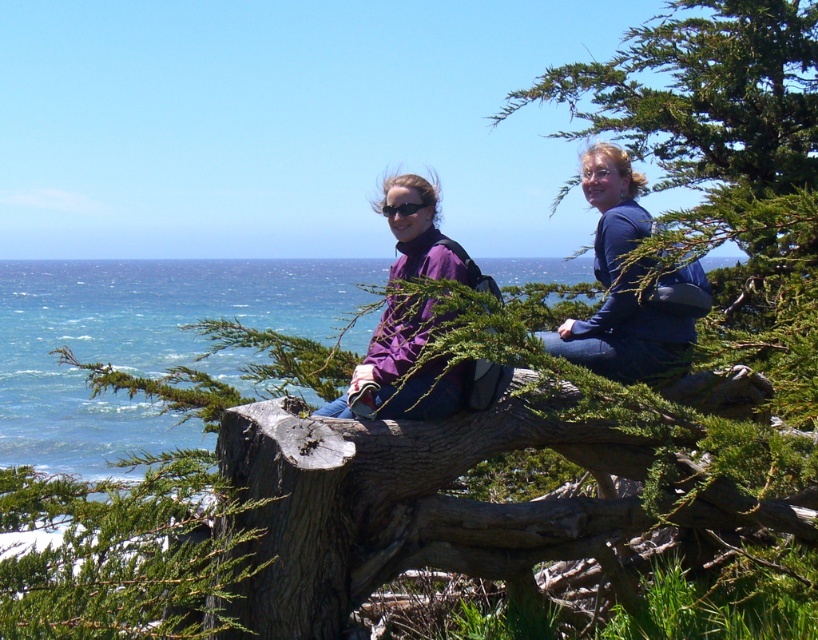
Question: Which object is farther from the camera taking this photo?

Choices:
 (A) purple fabric jacket at center
 (B) blue fabric jacket at upper center
 (C) purple matte jacket at center
 (D) blue water at upper left

Answer: (A)

Question: Which of these objects is positioned farthest from the purple fabric jacket at center?

Choices:
 (A) brown rough tree trunk at center
 (B) blue fabric jacket at upper center

Answer: (A)

Question: Considering the relative positions of blue water at upper left and purple fabric jacket at center in the image provided, where is blue water at upper left located with respect to purple fabric jacket at center?

Choices:
 (A) left
 (B) right

Answer: (A)

Question: Which point appears closest to the camera in this image?

Choices:
 (A) (299, 330)
 (B) (398, 452)

Answer: (B)

Question: In this image, where is brown rough tree trunk at center located relative to purple fabric jacket at center?

Choices:
 (A) left
 (B) right

Answer: (A)

Question: Does blue water at upper left have a lesser width compared to purple matte jacket at center?

Choices:
 (A) yes
 (B) no

Answer: (B)